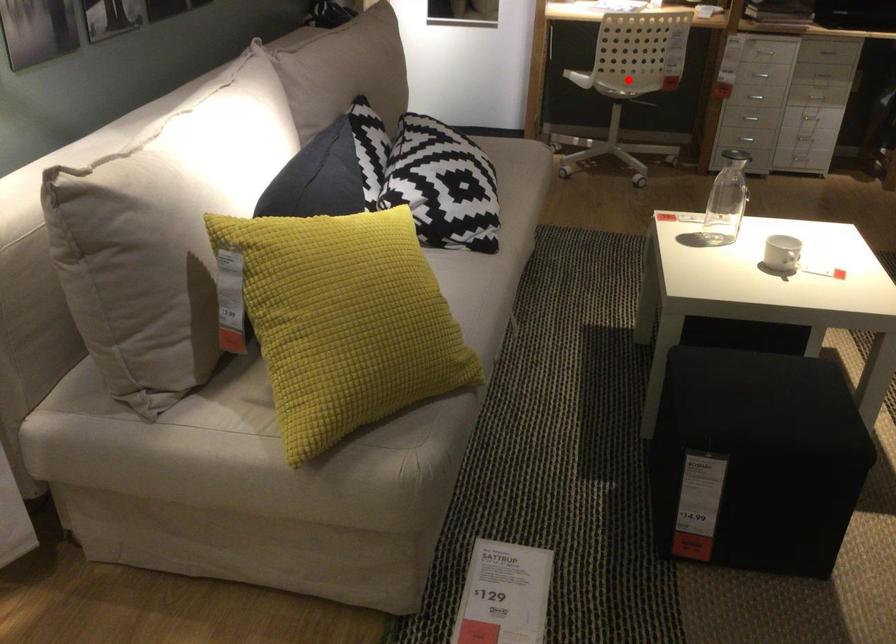
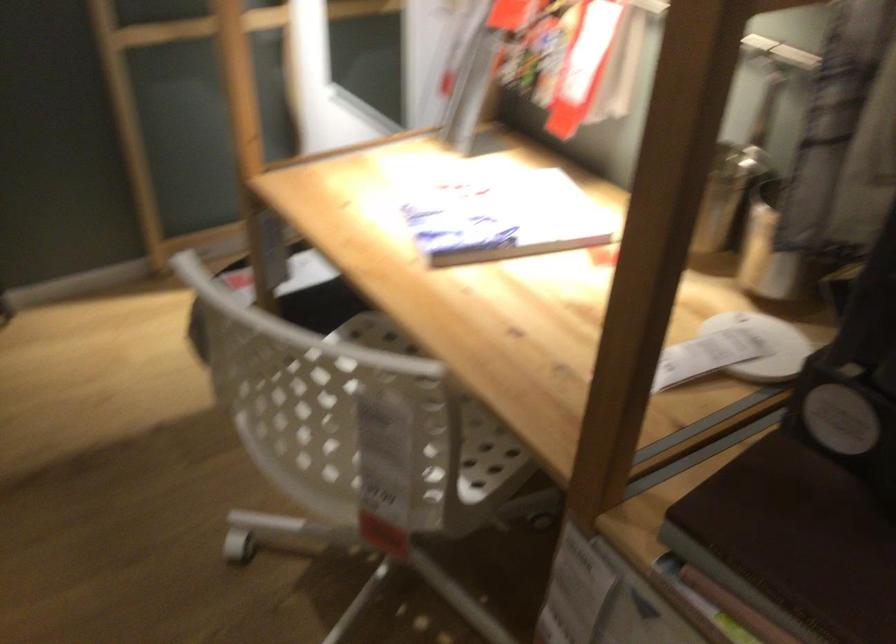
Question: I am providing you with two images of the same scene from different viewpoints. A red point is marked on the first image. At the location where the point appears in image 1, is it still visible in image 2?

Choices:
 (A) Yes
 (B) No

Answer: (B)